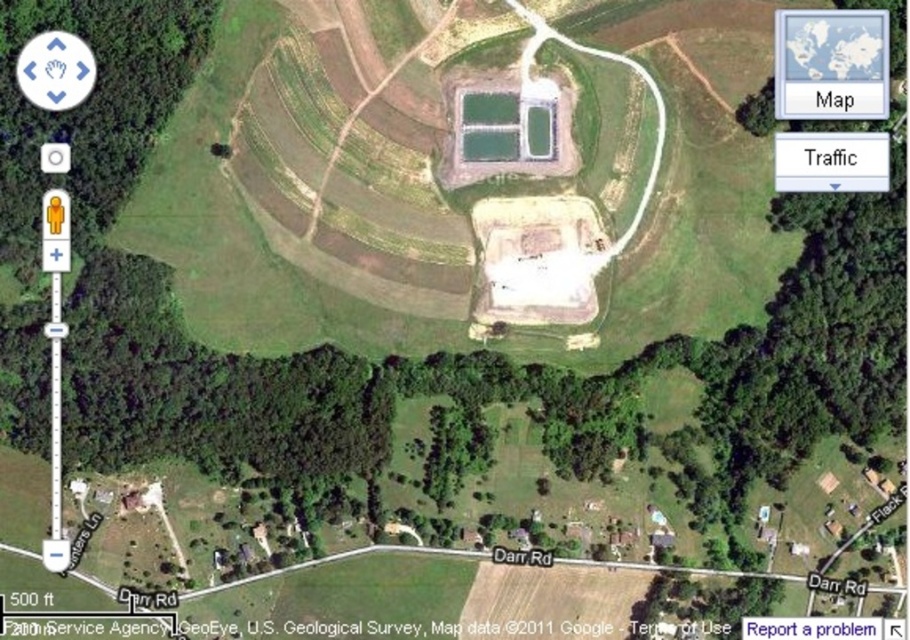
Based on the photo, does gray plastic map at upper right have a smaller size compared to white text on blue button at bottom right?

No, gray plastic map at upper right is not smaller than white text on blue button at bottom right.

Which of these two, gray plastic map at upper right or white text on blue button at bottom right, stands shorter?

white text on blue button at bottom right

What do you see at coordinates (831, 64) in the screenshot?
I see `gray plastic map at upper right` at bounding box center [831, 64].

This screenshot has width=910, height=640. I want to click on gray plastic map at upper right, so click(x=831, y=64).